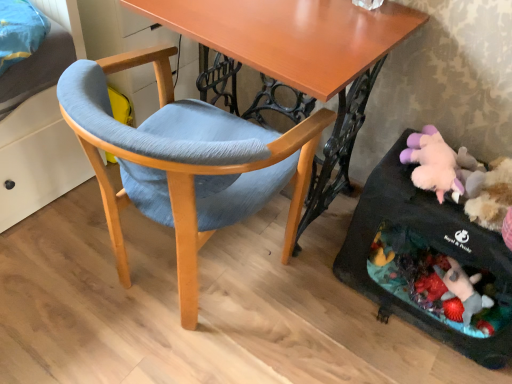
What are the coordinates of `free region under matte blue fabric chair at center (from a real-world perspective)` in the screenshot? It's located at (176, 279).